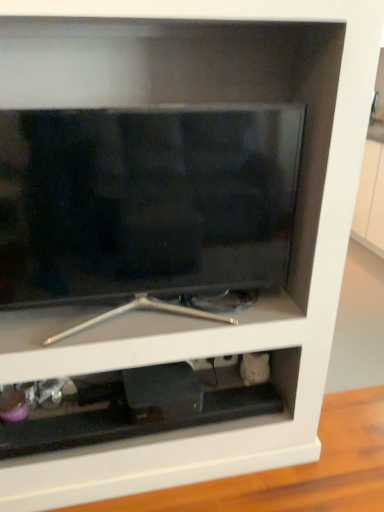
Find the location of a particular element. This screenshot has width=384, height=512. vacant space underneath matte black tv at center (from a real-world perspective) is located at coordinates (151, 324).